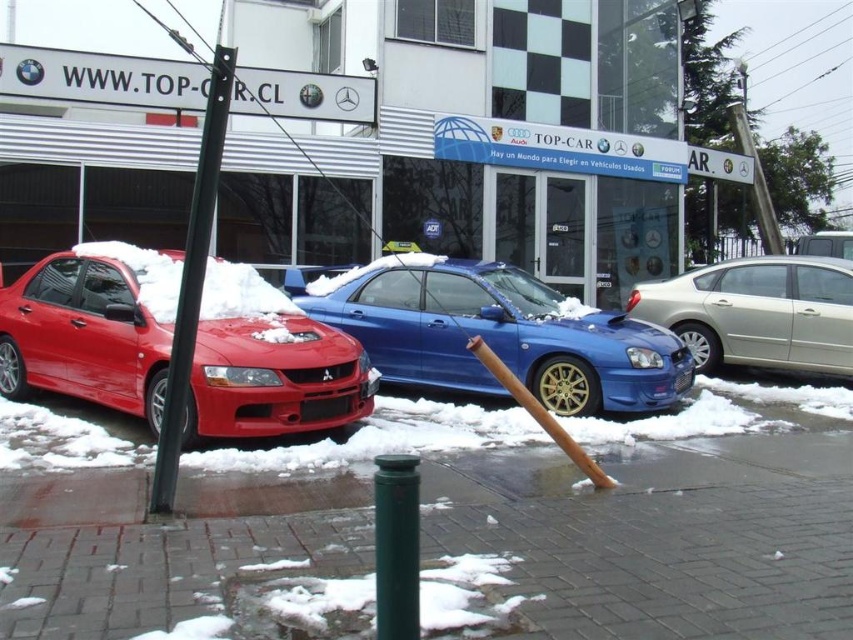
Does black metal pole at left have a lesser width compared to green matte pole at center?

In fact, black metal pole at left might be wider than green matte pole at center.

Does black metal pole at left lie behind green matte pole at center?

That is True.

You are a GUI agent. You are given a task and a screenshot of the screen. Output one action in this format:
    pyautogui.click(x=<x>, y=<y>)
    Task: Click on the black metal pole at left
    The image size is (853, 640).
    Given the screenshot: What is the action you would take?
    pyautogui.click(x=192, y=282)

Does matte red car at left have a greater height compared to metallic silver sedan at center?

Correct, matte red car at left is much taller as metallic silver sedan at center.

Image resolution: width=853 pixels, height=640 pixels. What do you see at coordinates (84, 332) in the screenshot?
I see `matte red car at left` at bounding box center [84, 332].

This screenshot has width=853, height=640. What do you see at coordinates (84, 332) in the screenshot? I see `matte red car at left` at bounding box center [84, 332].

At what (x,y) coordinates should I click in order to perform the action: click on matte red car at left. Please return your answer as a coordinate pair (x, y). Looking at the image, I should click on (84, 332).

Is matte red car at left bigger than black metal pole at left?

Indeed, matte red car at left has a larger size compared to black metal pole at left.

Between matte red car at left and black metal pole at left, which one is positioned lower?

matte red car at left

Find the location of `matte red car at left`. matte red car at left is located at coordinates (84, 332).

I want to click on matte red car at left, so click(x=84, y=332).